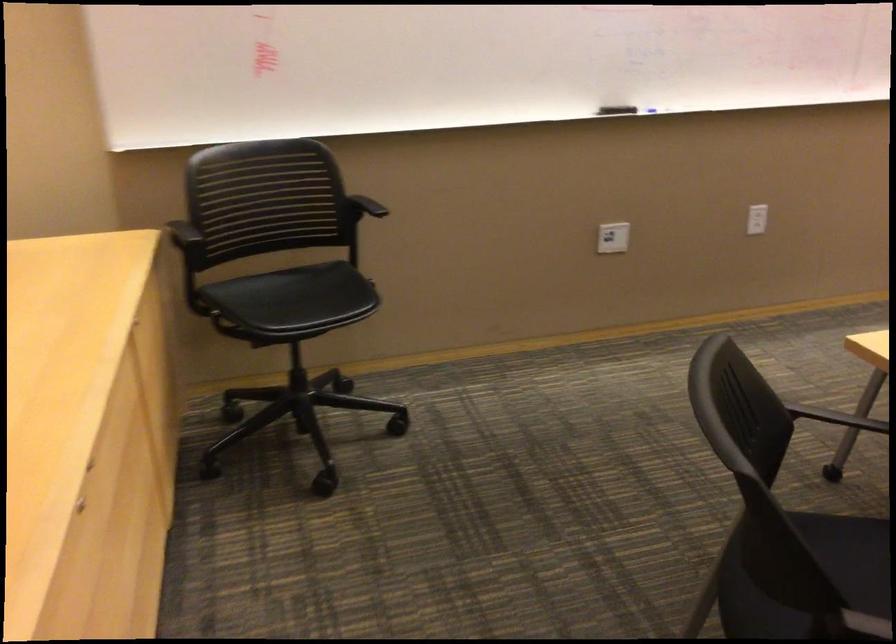
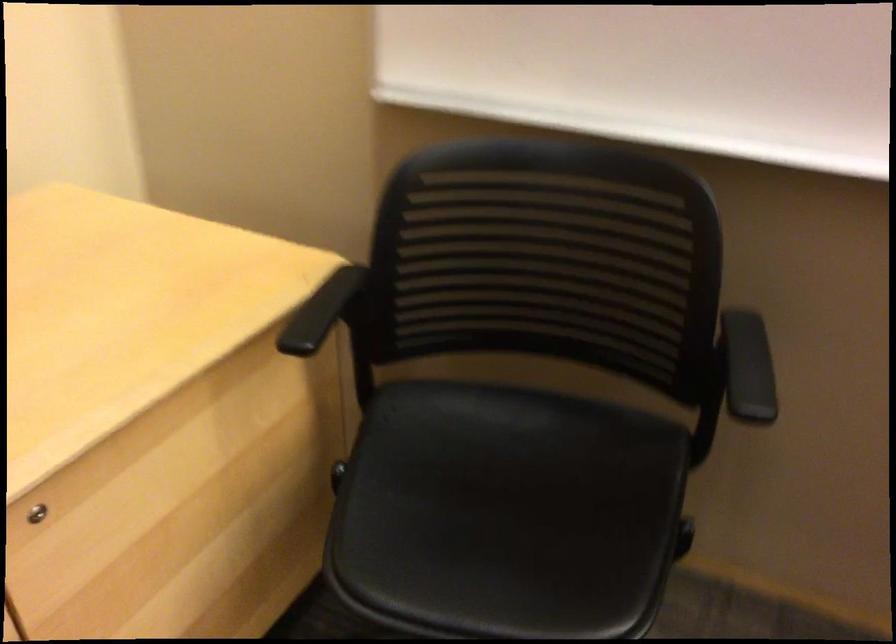
Find the pixel in the second image that matches point 174,247 in the first image.

(322, 310)